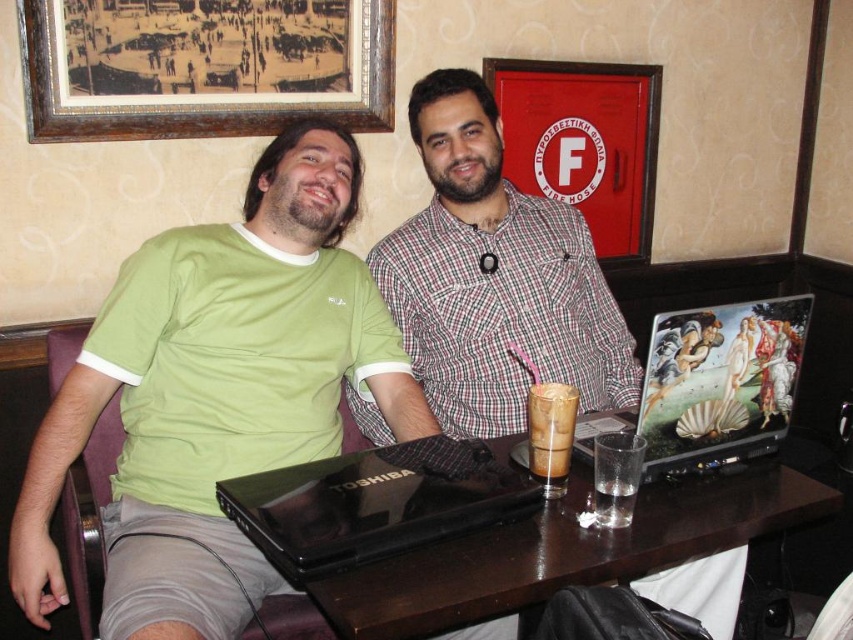
Question: Which point is closer to the camera taking this photo?

Choices:
 (A) (346, 513)
 (B) (242, 99)
 (C) (456, 266)

Answer: (A)

Question: Is black glossy table at center above red matte fire hose cabinet at upper center?

Choices:
 (A) yes
 (B) no

Answer: (B)

Question: Which of the following is the closest to the observer?

Choices:
 (A) (790, 484)
 (B) (392, 314)
 (C) (387, 259)

Answer: (A)

Question: From the image, what is the correct spatial relationship of plaid shirt at center in relation to red matte fire hose cabinet at upper center?

Choices:
 (A) above
 (B) below

Answer: (B)

Question: Does green matte shirt at center have a larger size compared to iced coffee at table right?

Choices:
 (A) yes
 (B) no

Answer: (A)

Question: Based on their relative distances, which object is nearer to the red matte fire hose cabinet at upper center?

Choices:
 (A) black glossy table at center
 (B) plaid shirt at center
 (C) wooden framed print at upper left
 (D) matte plaid shirt at center

Answer: (B)